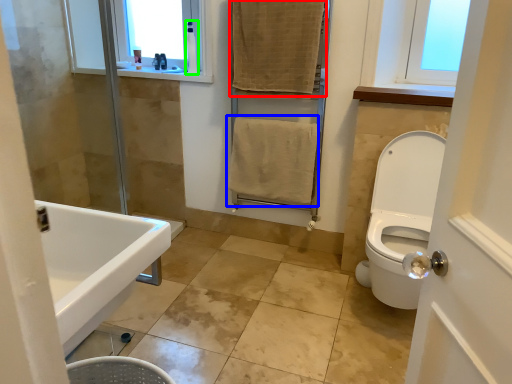
Question: Estimate the real-world distances between objects in this image. Which object is closer to bath towel (highlighted by a red box), bath towel (highlighted by a blue box) or toiletry (highlighted by a green box)?

Choices:
 (A) bath towel
 (B) toiletry

Answer: (A)